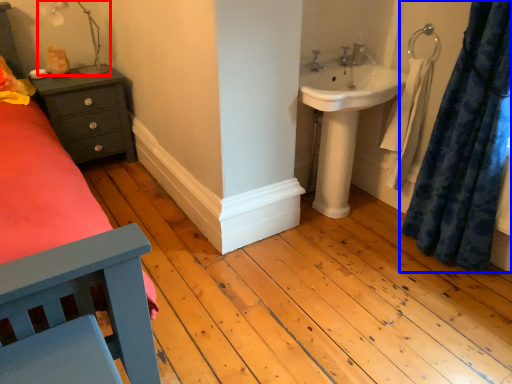
Question: Which of the following is the farthest to the observer, lamp (highlighted by a red box) or curtain (highlighted by a blue box)?

Choices:
 (A) lamp
 (B) curtain

Answer: (A)